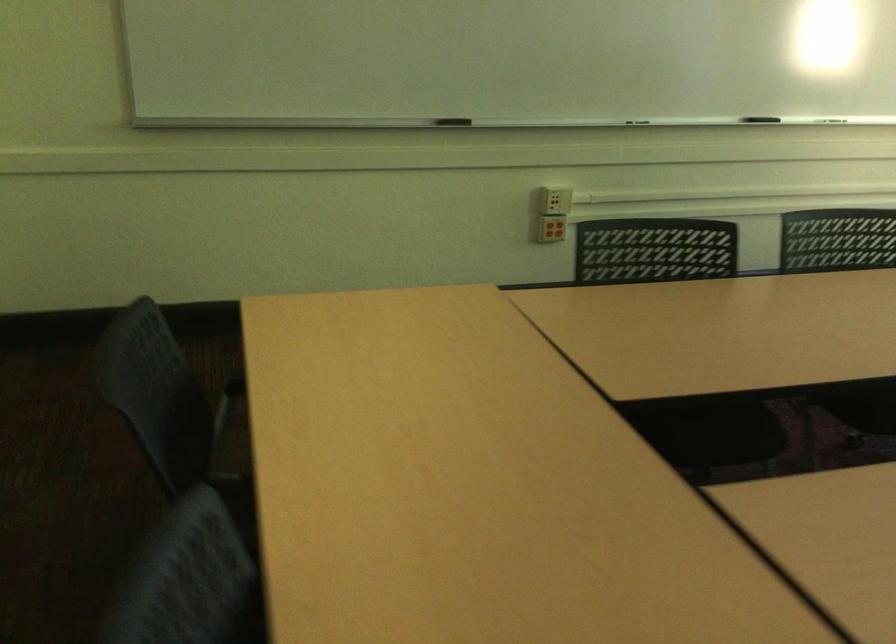
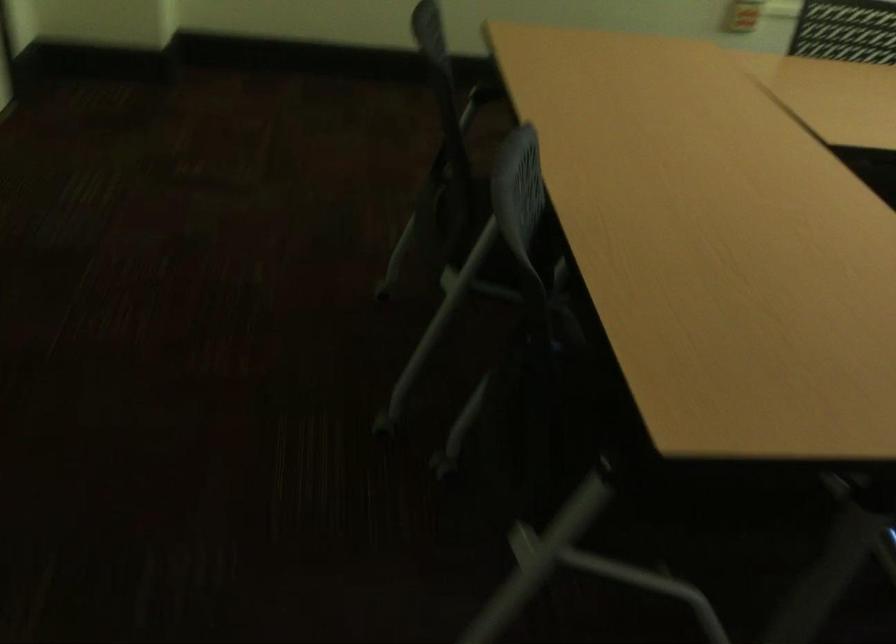
In a continuous first-person perspective shot, in which direction is the camera moving?

The movement direction of the cameraman is left, backward.